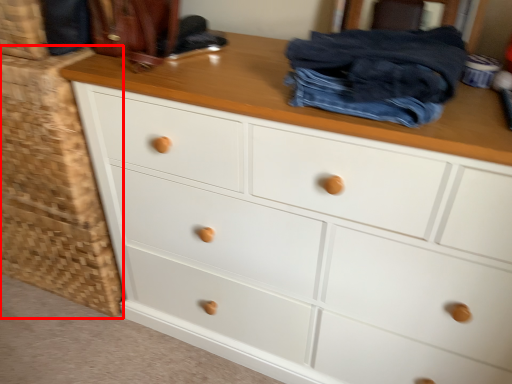
Question: From the image's perspective, considering the relative positions of cabinetry (annotated by the red box) and clothing in the image provided, where is cabinetry (annotated by the red box) located with respect to the staircase?

Choices:
 (A) above
 (B) below

Answer: (B)